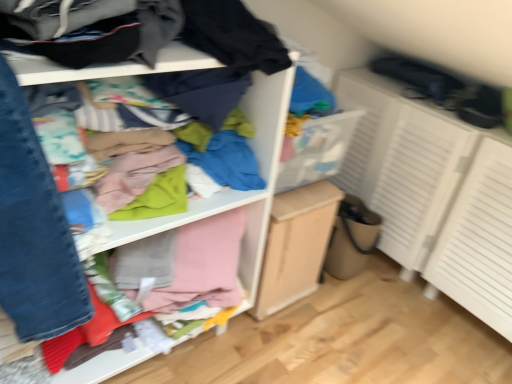
Image resolution: width=512 pixels, height=384 pixels. What do you see at coordinates (295, 245) in the screenshot?
I see `light wood/file cabinet at center` at bounding box center [295, 245].

Find the location of a particular element. cloth at upper left is located at coordinates (234, 190).

From the image's perspective, which is below, cloth at upper left or white textured cabinet at right?

cloth at upper left is shown below in the image.

Can you tell me how much cloth at upper left and white textured cabinet at right differ in facing direction?

The angle between the facing direction of cloth at upper left and the facing direction of white textured cabinet at right is 89.4 degrees.

Is cloth at upper left to the left of white textured cabinet at right from the viewer's perspective?

Yes, cloth at upper left is to the left of white textured cabinet at right.

Is cloth at upper left oriented towards white textured cabinet at right?

No, cloth at upper left is not oriented towards white textured cabinet at right.

From a real-world perspective, which object stands above the other?

white textured cabinet at right.

Which is closer, (267, 281) or (394, 258)?

The point (267, 281) is closer to the camera.

Is light wood/file cabinet at center further to camera compared to white textured cabinet at right?

Yes.

From the picture: Would you say light wood/file cabinet at center contains white textured cabinet at right?

Actually, white textured cabinet at right is outside light wood/file cabinet at center.

Considering the relative positions of cloth at upper left and light wood/file cabinet at center in the image provided, is cloth at upper left behind light wood/file cabinet at center?

No, cloth at upper left is in front of light wood/file cabinet at center.

Who is smaller, cloth at upper left or light wood/file cabinet at center?

light wood/file cabinet at center is smaller.

Are cloth at upper left and light wood/file cabinet at center located far from each other?

No.

How much distance is there between white textured cabinet at right and light wood/file cabinet at center?

white textured cabinet at right is 47.43 centimeters away from light wood/file cabinet at center.

From the picture: Considering the sizes of objects white textured cabinet at right and light wood/file cabinet at center in the image provided, who is taller, white textured cabinet at right or light wood/file cabinet at center?

With more height is white textured cabinet at right.

Considering the positions of objects white textured cabinet at right and light wood/file cabinet at center in the image provided, who is more to the right, white textured cabinet at right or light wood/file cabinet at center?

white textured cabinet at right is more to the right.

Is light wood/file cabinet at center with cloth at upper left?

light wood/file cabinet at center is not next to cloth at upper left, and they're not touching.

Is light wood/file cabinet at center positioned behind cloth at upper left?

Yes, the depth of light wood/file cabinet at center is greater than that of cloth at upper left.

Measure the distance between light wood/file cabinet at center and cloth at upper left.

They are 7.07 inches apart.

Can you confirm if light wood/file cabinet at center is positioned to the left of cloth at upper left?

No.

From the image's perspective, is white textured cabinet at right above or below cloth at upper left?

Based on their image positions, white textured cabinet at right is located above cloth at upper left.

Measure the distance between white textured cabinet at right and cloth at upper left.

white textured cabinet at right is 72.01 centimeters away from cloth at upper left.

Which is in front, white textured cabinet at right or cloth at upper left?

cloth at upper left is in front.

Choose the correct answer: Is white textured cabinet at right inside cloth at upper left or outside it?

white textured cabinet at right is located beyond the bounds of cloth at upper left.

This screenshot has width=512, height=384. In order to click on cabinetry behind the cloth at upper left in this screenshot , I will do `click(434, 194)`.

Locate an element on the screen. This screenshot has width=512, height=384. cabinetry above the light wood/file cabinet at center (from the image's perspective) is located at coordinates (434, 194).

Looking at the image, which one is located closer to white textured cabinet at right, light wood/file cabinet at center or cloth at upper left?

light wood/file cabinet at center.

Estimate the real-world distances between objects in this image. Which object is closer to white textured cabinet at right, cloth at upper left or light wood/file cabinet at center?

light wood/file cabinet at center is closer to white textured cabinet at right.

Looking at the image, which one is located further to cloth at upper left, white textured cabinet at right or light wood/file cabinet at center?

The object further to cloth at upper left is white textured cabinet at right.

When comparing their distances from light wood/file cabinet at center, does white textured cabinet at right or cloth at upper left seem closer?

cloth at upper left lies closer to light wood/file cabinet at center than the other object.

When comparing their distances from light wood/file cabinet at center, does cloth at upper left or white textured cabinet at right seem further?

The object further to light wood/file cabinet at center is white textured cabinet at right.

Looking at the image, which one is located closer to cloth at upper left, light wood/file cabinet at center or white textured cabinet at right?

The object closer to cloth at upper left is light wood/file cabinet at center.

You are a GUI agent. You are given a task and a screenshot of the screen. Output one action in this format:
    pyautogui.click(x=<x>, y=<y>)
    Task: Click on the file cabinet located between cloth at upper left and white textured cabinet at right in the left-right direction
    This screenshot has height=384, width=512.
    Given the screenshot: What is the action you would take?
    pyautogui.click(x=295, y=245)